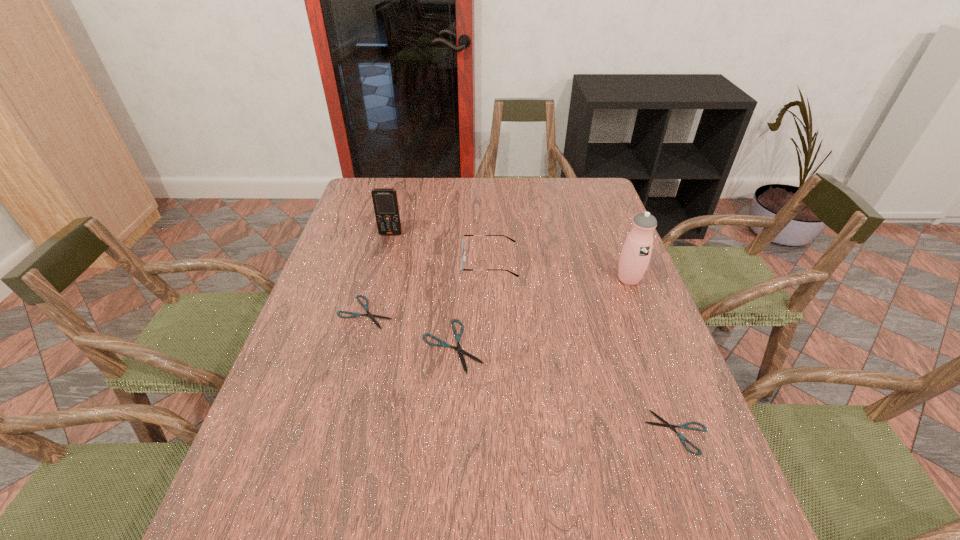
The image size is (960, 540). Identify the location of vacant space in between the tallest object and the second tallest shears. (497, 296).

Identify the location of vacant area that lies between the second shears from left to right and the farthest object. (422, 290).

The image size is (960, 540). In order to click on vacant space in between the thermos bottle and the farthest object in this screenshot , I will do `click(510, 257)`.

In order to click on free area in between the farthest object and the thermos bottle in this screenshot , I will do `click(510, 257)`.

At what (x,y) coordinates should I click in order to perform the action: click on free spot between the spectacles and the cellular telephone. Please return your answer as a coordinate pair (x, y). The width and height of the screenshot is (960, 540). Looking at the image, I should click on (441, 248).

You are a GUI agent. You are given a task and a screenshot of the screen. Output one action in this format:
    pyautogui.click(x=<x>, y=<y>)
    Task: Click on the free space that is in between the nearest shears and the cellular telephone
    The width and height of the screenshot is (960, 540).
    Given the screenshot: What is the action you would take?
    (x=534, y=333)

In order to click on vacant region between the second tallest object and the leftmost shears in this screenshot , I will do click(x=378, y=273).

Image resolution: width=960 pixels, height=540 pixels. In order to click on free spot between the second tallest shears and the farthest object in this screenshot , I will do (x=378, y=273).

Where is `free spot between the cellular telephone and the rightmost shears`? The height and width of the screenshot is (540, 960). free spot between the cellular telephone and the rightmost shears is located at coordinates 534,333.

Choose which object is the third nearest neighbor to the cellular telephone. Please provide its 2D coordinates. Your answer should be formatted as a tuple, i.e. [(x, y)], where the tuple contains the x and y coordinates of a point satisfying the conditions above.

[(442, 344)]